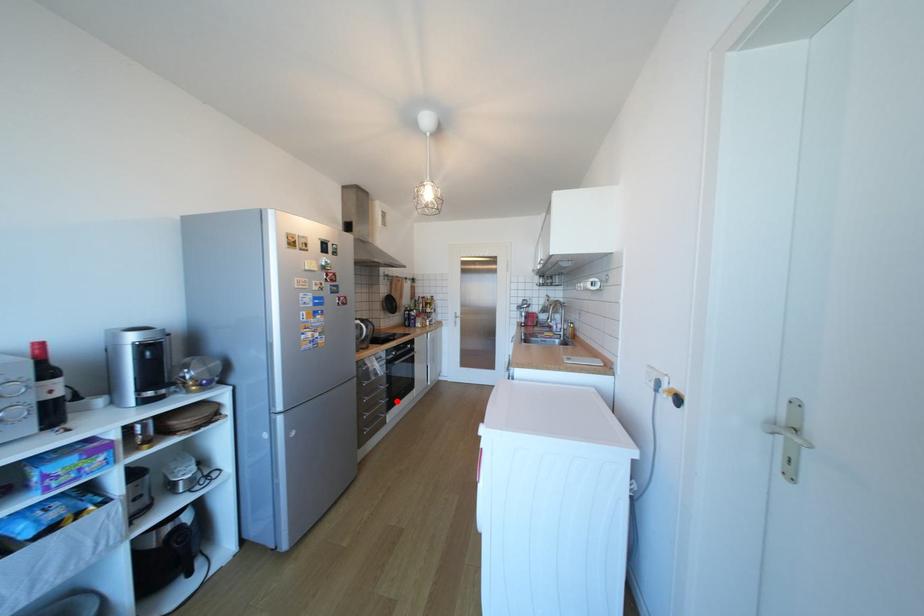
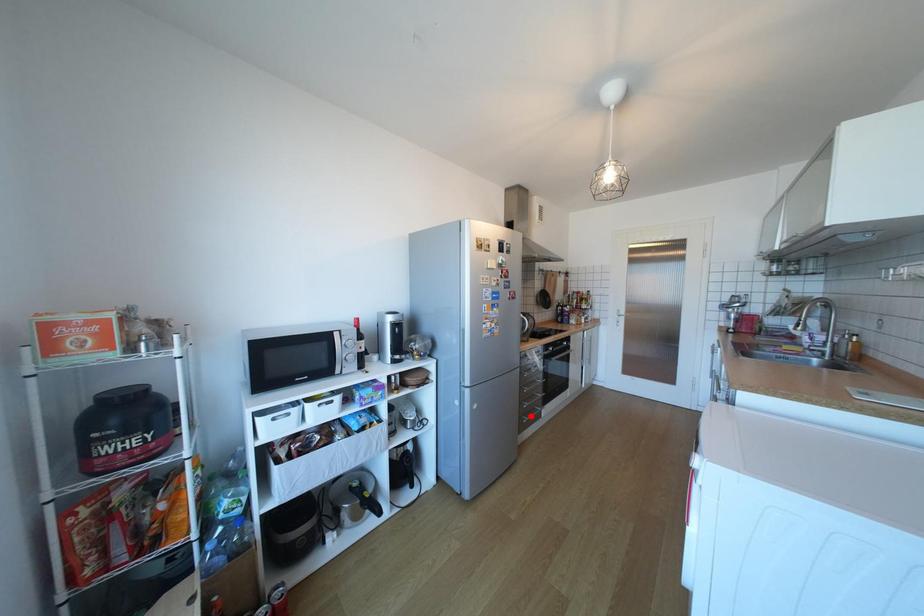
I am providing you with two images of the same scene from different viewpoints. A red point is marked on the first image and another point is marked on the second image. Does the point marked in image1 correspond to the same location as the one in image2?

No